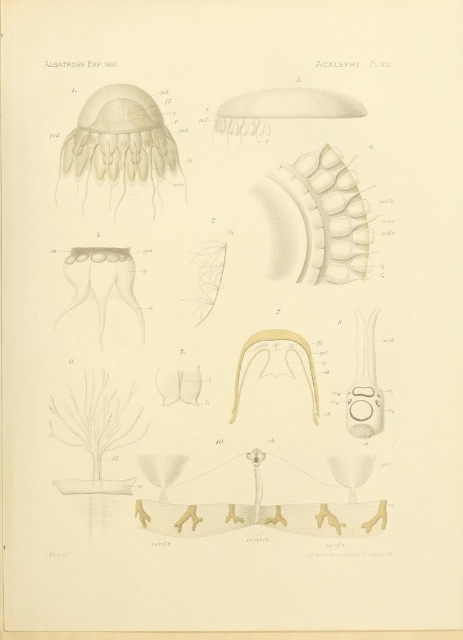
Which is more to the right, transparent gelatinous jellyfish at upper center or translucent yellow jellyfish at center?

From the viewer's perspective, transparent gelatinous jellyfish at upper center appears more on the right side.

Identify the location of transparent gelatinous jellyfish at upper center. (281, 109).

Is point (335, 112) less distant than point (233, 403)?

Yes, point (335, 112) is closer to viewer.

Image resolution: width=463 pixels, height=640 pixels. I want to click on transparent gelatinous jellyfish at upper center, so click(281, 109).

You are a GUI agent. You are given a task and a screenshot of the screen. Output one action in this format:
    pyautogui.click(x=<x>, y=<y>)
    Task: Click on the translucent beige jellyfish at upper left
    The width and height of the screenshot is (463, 640).
    Given the screenshot: What is the action you would take?
    pyautogui.click(x=119, y=141)

Which is in front, point (148, 156) or point (318, 412)?

Point (148, 156) is in front.

Find the location of a particular element. This screenshot has width=463, height=640. translucent beige jellyfish at upper left is located at coordinates (119, 141).

Between point (301, 205) and point (262, 124), which one is positioned behind?

Point (301, 205)

Is point (357, 253) closer to camera compared to point (254, 128)?

No, (357, 253) is behind (254, 128).

Which is behind, point (319, 198) or point (330, 113)?

The point (319, 198) is behind.

The height and width of the screenshot is (640, 463). I want to click on smooth beige jellyfish at upper center, so click(x=327, y=216).